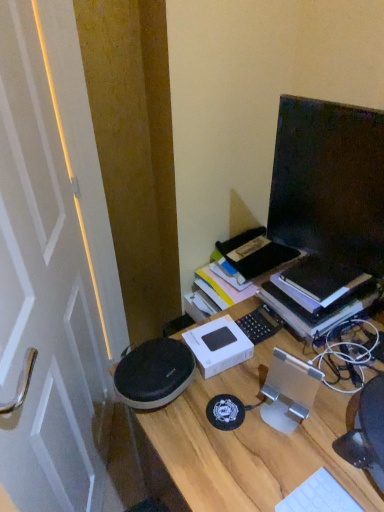
Find the location of `empty space that is ontop of wooden desk at center (from a real-world perspective)`. empty space that is ontop of wooden desk at center (from a real-world perspective) is located at coordinates (300, 410).